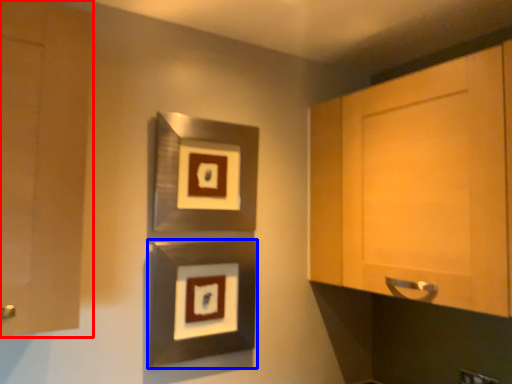
Question: Which of the following is the closest to the observer, cabinetry (highlighted by a red box) or picture frame (highlighted by a blue box)?

Choices:
 (A) cabinetry
 (B) picture frame

Answer: (A)